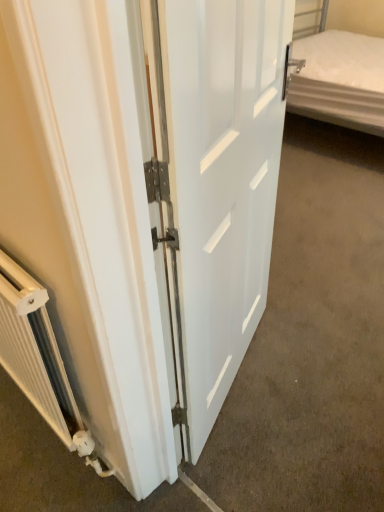
Locate an element on the screen. This screenshot has height=512, width=384. white matte door at center is located at coordinates (219, 175).

Describe the element at coordinates (219, 175) in the screenshot. I see `white matte door at center` at that location.

Where is `white matte door at center`? The width and height of the screenshot is (384, 512). white matte door at center is located at coordinates (219, 175).